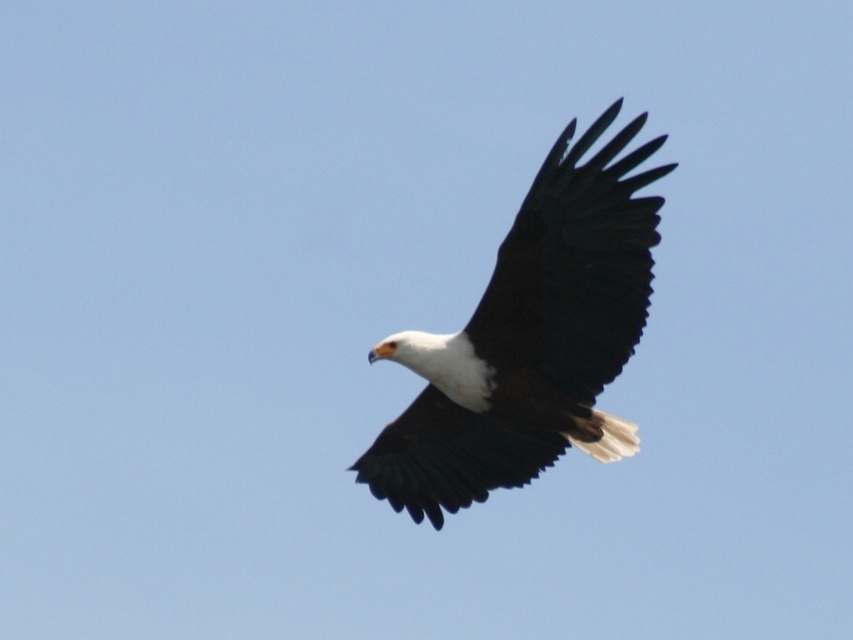
Question: Is white matte eagle at center above black matte wing at center?

Choices:
 (A) yes
 (B) no

Answer: (B)

Question: Which point appears closest to the camera in this image?

Choices:
 (A) (624, 138)
 (B) (563, 225)

Answer: (A)

Question: Which point appears closest to the camera in this image?

Choices:
 (A) (631, 344)
 (B) (403, 422)

Answer: (A)

Question: Considering the relative positions of white matte eagle at center and black matte wing at center in the image provided, where is white matte eagle at center located with respect to black matte wing at center?

Choices:
 (A) left
 (B) right

Answer: (A)

Question: Can you confirm if white matte eagle at center is bigger than black matte wing at center?

Choices:
 (A) no
 (B) yes

Answer: (B)

Question: Among these points, which one is farthest from the camera?

Choices:
 (A) (657, 236)
 (B) (578, 208)

Answer: (A)